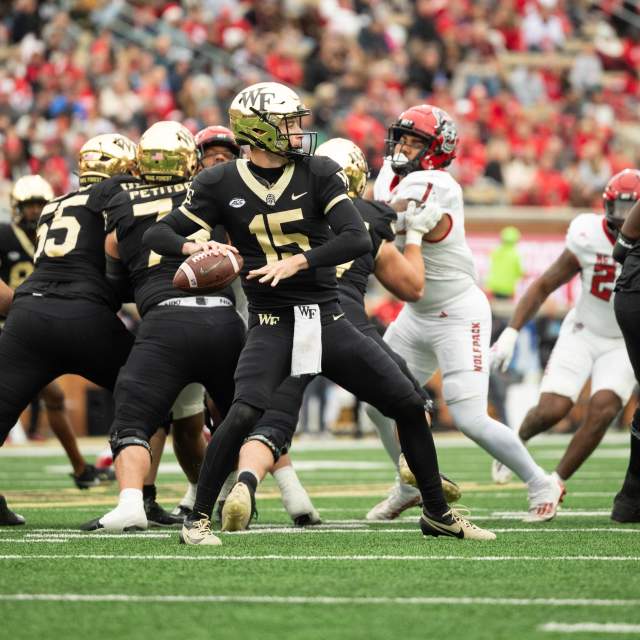
The height and width of the screenshot is (640, 640). I want to click on towel, so click(308, 333).